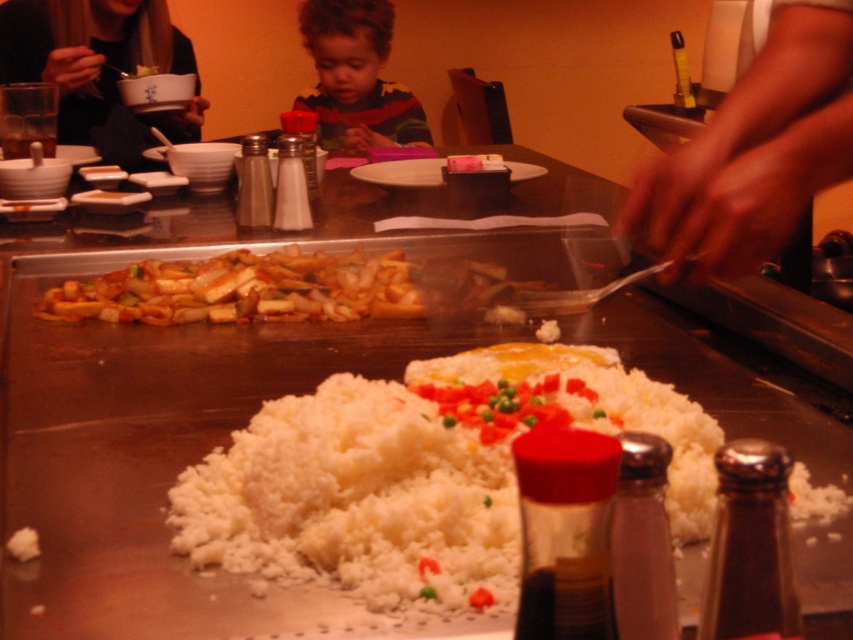
This screenshot has height=640, width=853. What are the coordinates of `smooth skin hands at center right` in the screenshot? It's located at (753, 150).

Is smooth skin hands at center right wider than blonde hair at upper left?

No, smooth skin hands at center right is not wider than blonde hair at upper left.

Is point (734, 96) farther from camera compared to point (38, 51)?

That is False.

This screenshot has width=853, height=640. I want to click on smooth skin hands at center right, so click(x=753, y=150).

In the scene shown: Which is below, smooth skin hands at center right or brown glossy stir-fry at center?

brown glossy stir-fry at center is lower down.

Which of these two, smooth skin hands at center right or brown glossy stir-fry at center, stands taller?

smooth skin hands at center right

In order to click on smooth skin hands at center right in this screenshot , I will do `click(753, 150)`.

Between smooth skin hands at center right and curly-haired toddler at center, which one has less height?

smooth skin hands at center right

Which is more to the left, smooth skin hands at center right or curly-haired toddler at center?

curly-haired toddler at center is more to the left.

Does point (631, 230) lie in front of point (328, 100)?

Yes.

Identify the location of smooth skin hands at center right. (753, 150).